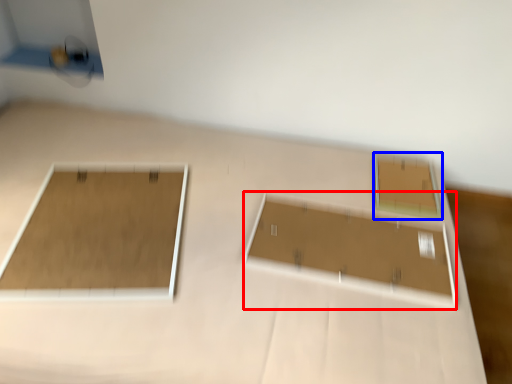
Question: Which object is closer to the camera taking this photo, rectangle (highlighted by a red box) or rectangle (highlighted by a blue box)?

Choices:
 (A) rectangle
 (B) rectangle

Answer: (A)